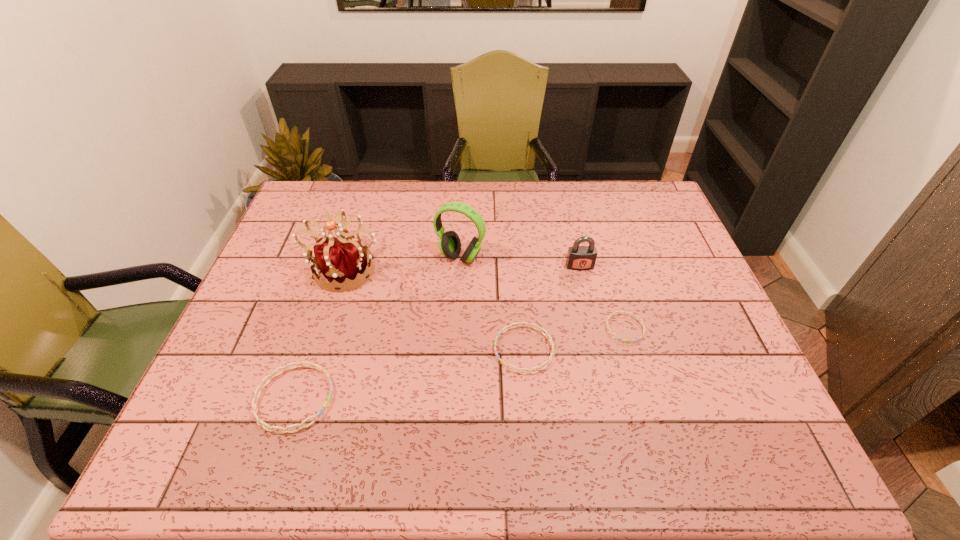
If equal spacing is desired by inserting an extra bracelet among them, please point out a free spot for this new bracelet. Please provide its 2D coordinates. Your answer should be formatted as a tuple, i.e. [(x, y)], where the tuple contains the x and y coordinates of a point satisfying the conditions above.

[(415, 373)]